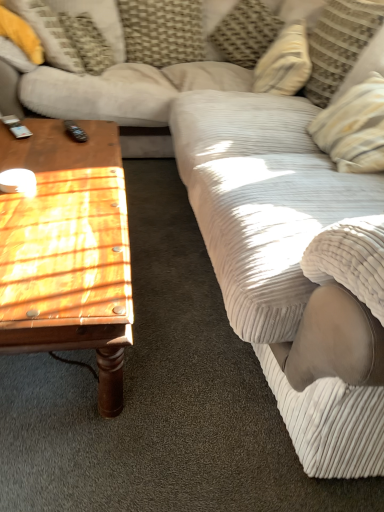
The image size is (384, 512). I want to click on free space above wooden polished coffee table at left (from a real-world perspective), so click(53, 188).